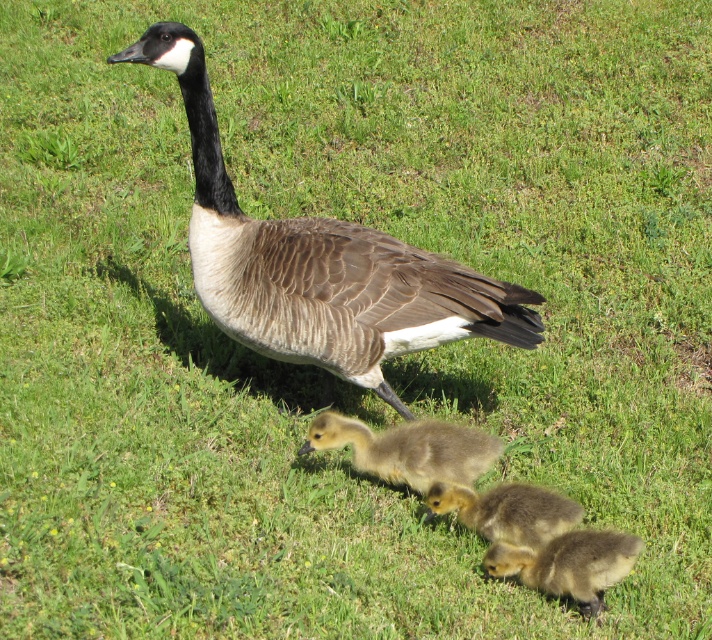
Who is shorter, brown fuzzy gosling at center or soft yellow downy gosling at center?

soft yellow downy gosling at center

Does brown fuzzy gosling at center appear under soft yellow downy gosling at center?

No, brown fuzzy gosling at center is not below soft yellow downy gosling at center.

Is point (387, 451) less distant than point (483, 516)?

No, it is behind (483, 516).

Locate an element on the screen. brown fuzzy gosling at center is located at coordinates (408, 449).

Can you confirm if brown textured goose at center is positioned to the left of soft yellow downy gosling at center?

Correct, you'll find brown textured goose at center to the left of soft yellow downy gosling at center.

Which is in front, point (188, 54) or point (486, 529)?

Point (188, 54) is more forward.

This screenshot has height=640, width=712. Identify the location of brown textured goose at center. (319, 262).

Does brown fuzzy gosling at center come behind soft yellow downy gosling at lower center?

Yes, it is behind soft yellow downy gosling at lower center.

Consider the image. Does brown fuzzy gosling at center have a greater width compared to soft yellow downy gosling at lower center?

Indeed, brown fuzzy gosling at center has a greater width compared to soft yellow downy gosling at lower center.

Does point (360, 461) lie behind point (543, 556)?

Yes, it is.

Identify the location of brown fuzzy gosling at center. (408, 449).